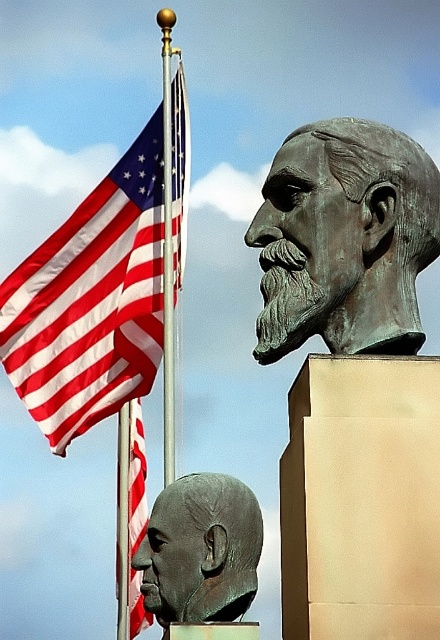
Between red-white striped fabric at left and bronze head at center, which one appears on the right side from the viewer's perspective?

bronze head at center

Does red-white striped fabric at left appear under bronze head at center?

Actually, red-white striped fabric at left is above bronze head at center.

Is point (33, 410) closer to viewer compared to point (212, 548)?

No, it is behind (212, 548).

I want to click on red-white striped fabric at left, so click(101, 289).

Is point (437, 243) positioned behind point (182, 588)?

No, (437, 243) is closer to viewer.

Does bronze statue at upper center have a smaller size compared to bronze head at center?

Correct, bronze statue at upper center occupies less space than bronze head at center.

Is point (277, 316) positioned in front of point (194, 577)?

Yes, point (277, 316) is closer to viewer.

At what (x,y) coordinates should I click in order to perform the action: click on bronze statue at upper center. Please return your answer as a coordinate pair (x, y). The width and height of the screenshot is (440, 640). Looking at the image, I should click on (344, 240).

In the scene shown: Can you confirm if red-white striped fabric at left is positioned to the right of bronze statue at upper center?

In fact, red-white striped fabric at left is to the left of bronze statue at upper center.

Looking at this image, can you confirm if red-white striped fabric at left is positioned above bronze statue at upper center?

Correct, red-white striped fabric at left is located above bronze statue at upper center.

Who is more distant from viewer, (117, 397) or (323, 253)?

The point (117, 397) is behind.

Locate an element on the screen. red-white striped fabric at left is located at coordinates (101, 289).